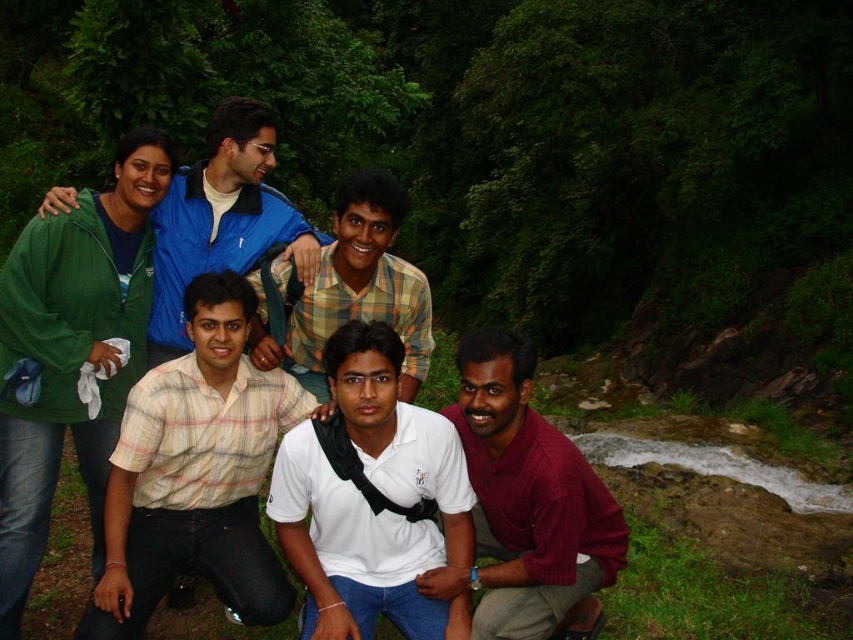
Question: Which object is positioned closest to the green fleece jacket at upper left?

Choices:
 (A) checkered fabric shirt at center
 (B) white matte shirt at center

Answer: (A)

Question: Which point is closer to the camera?

Choices:
 (A) checkered fabric shirt at center
 (B) maroon knitwear at lower right
 (C) green fleece jacket at upper left

Answer: (B)

Question: Is yellow plaid shirt at center bigger than checkered fabric shirt at center?

Choices:
 (A) no
 (B) yes

Answer: (A)

Question: Which point is closer to the camera?

Choices:
 (A) (341, 534)
 (B) (149, 465)

Answer: (B)

Question: Is green fleece jacket at upper left to the right of checkered fabric shirt at center from the viewer's perspective?

Choices:
 (A) yes
 (B) no

Answer: (B)

Question: Is green fabric jacket at upper left thinner than checkered fabric shirt at center?

Choices:
 (A) no
 (B) yes

Answer: (B)